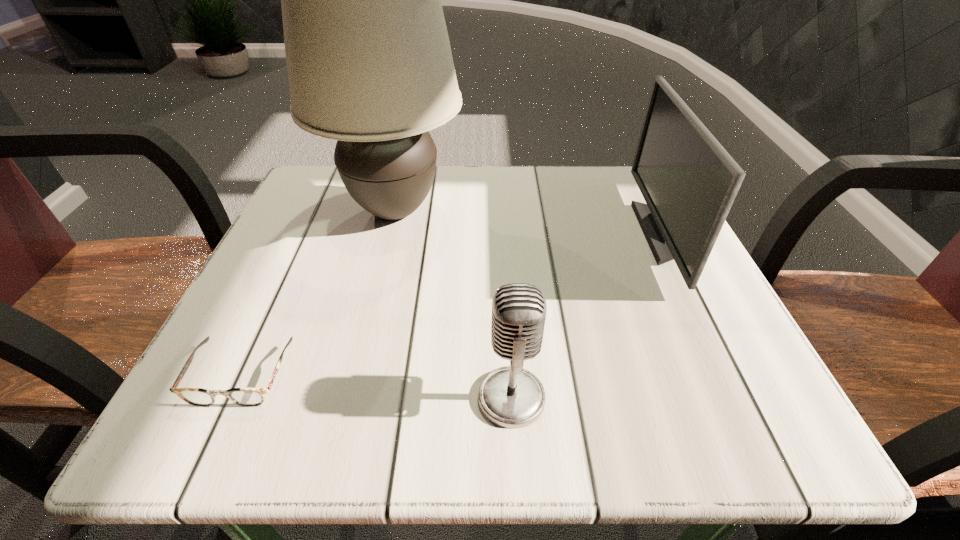
Where is `lampshade`? lampshade is located at coordinates (369, 62).

Locate an element on the screen. monitor is located at coordinates (689, 182).

Where is `the third shortest object`? Image resolution: width=960 pixels, height=540 pixels. the third shortest object is located at coordinates (689, 182).

This screenshot has height=540, width=960. What are the coordinates of `microphone` in the screenshot? It's located at (512, 397).

At what (x,y) coordinates should I click in order to perform the action: click on the second shortest object. Please return your answer as a coordinate pair (x, y). Looking at the image, I should click on (512, 397).

The image size is (960, 540). What are the coordinates of `the shortest object` in the screenshot? It's located at (248, 397).

Find the location of a particular element. Image resolution: width=960 pixels, height=540 pixels. free region located 0.360m on the right of the lampshade is located at coordinates (637, 211).

I want to click on vacant space located 0.080m on the screen side of the third shortest object, so pos(603,233).

The height and width of the screenshot is (540, 960). I want to click on vacant space positioned on the screen side of the third shortest object, so click(603, 233).

Find the location of a particular element. This screenshot has width=960, height=540. free space located on the screen side of the third shortest object is located at coordinates (521, 233).